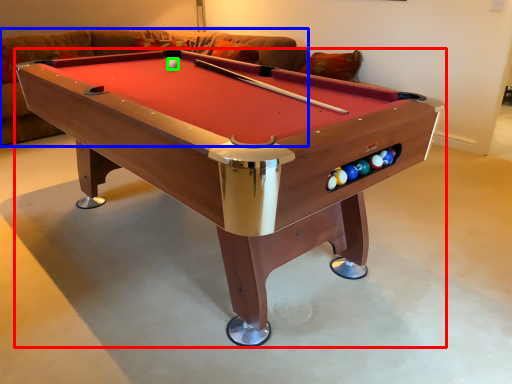
Question: Which object is positioned farthest from billiard table (highlighted by a red box)? Select from couch (highlighted by a blue box) and ball (highlighted by a green box).

Choices:
 (A) couch
 (B) ball

Answer: (A)